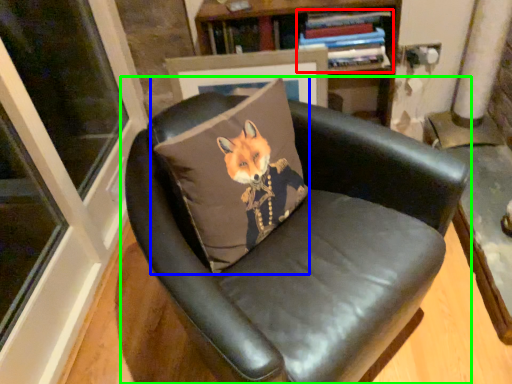
Question: Estimate the real-world distances between objects in this image. Which object is farther from book (highlighted by a red box), throw pillow (highlighted by a blue box) or chair (highlighted by a green box)?

Choices:
 (A) throw pillow
 (B) chair

Answer: (B)